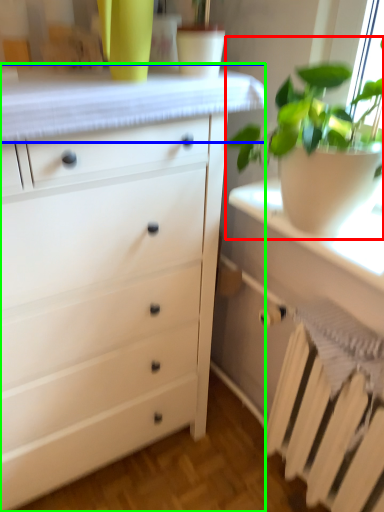
Question: Which object is positioned farthest from houseplant (highlighted by a red box)? Select from counter top (highlighted by a blue box) and chest of drawers (highlighted by a green box).

Choices:
 (A) counter top
 (B) chest of drawers

Answer: (B)